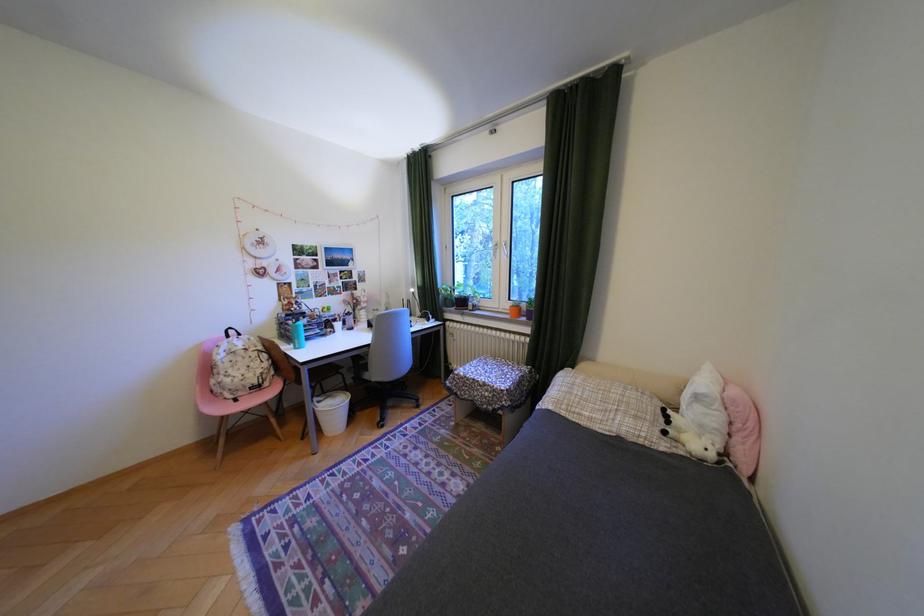
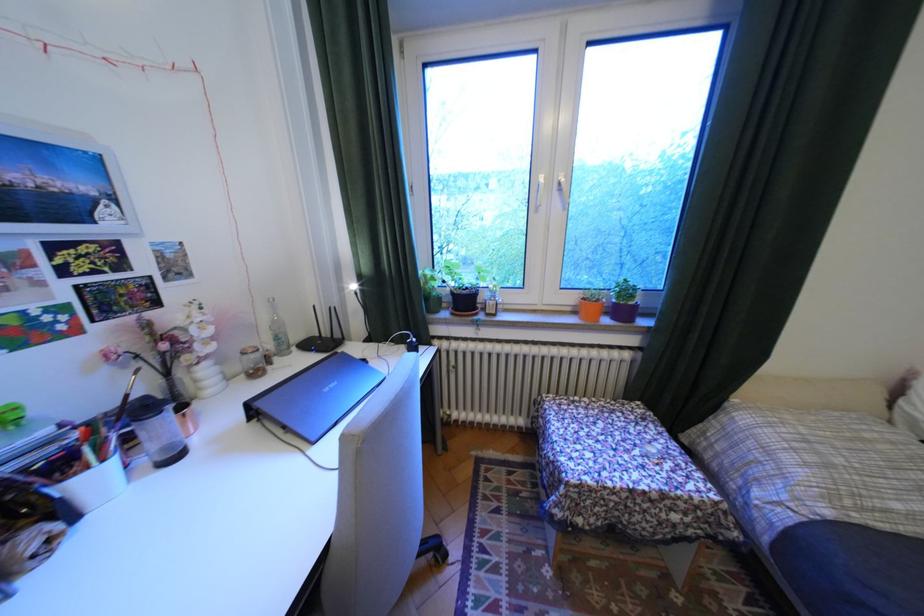
The point at (361, 320) is marked in the first image. Where is the corresponding point in the second image?

(172, 424)